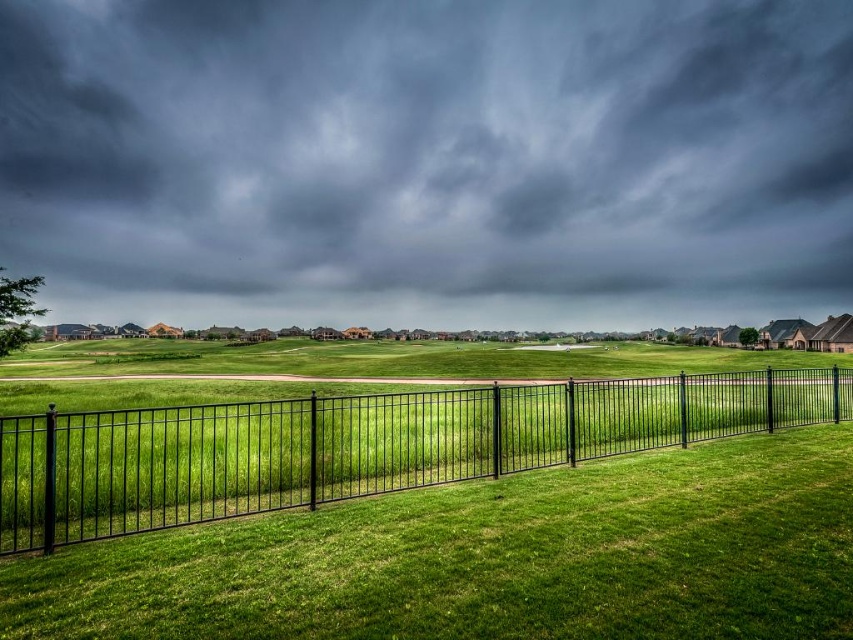
Question: Can you confirm if dark gray cloud at upper center is positioned to the left of black metal fence at center?

Choices:
 (A) yes
 (B) no

Answer: (A)

Question: Which point is farther to the camera?

Choices:
 (A) pos(821,376)
 (B) pos(305,113)

Answer: (B)

Question: Among these objects, which one is farthest from the camera?

Choices:
 (A) black metal fence at center
 (B) dark gray cloud at upper center

Answer: (B)

Question: Is dark gray cloud at upper center to the left of black metal fence at center from the viewer's perspective?

Choices:
 (A) no
 (B) yes

Answer: (B)

Question: Which point is closer to the camera?

Choices:
 (A) (425, 422)
 (B) (309, 292)

Answer: (A)

Question: Is dark gray cloud at upper center bigger than black metal fence at center?

Choices:
 (A) yes
 (B) no

Answer: (A)